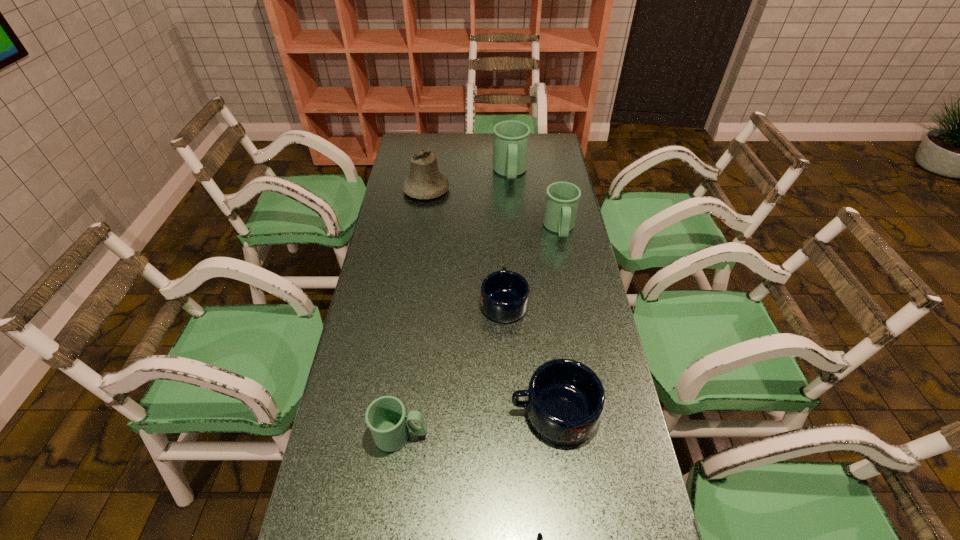
The height and width of the screenshot is (540, 960). What are the coordinates of `the farthest mug` in the screenshot? It's located at (510, 149).

Find the location of a particular element. The image size is (960, 540). the second green mug from left to right is located at coordinates (510, 149).

Where is `bell`? bell is located at coordinates (425, 181).

The width and height of the screenshot is (960, 540). Find the location of `the second biggest green mug`. the second biggest green mug is located at coordinates (562, 199).

Where is `the second farthest mug`? The height and width of the screenshot is (540, 960). the second farthest mug is located at coordinates (562, 199).

Where is `the second nearest blue mug`? The height and width of the screenshot is (540, 960). the second nearest blue mug is located at coordinates (565, 400).

Find the location of a particular element. the leftmost mug is located at coordinates pyautogui.click(x=385, y=416).

Where is `the leftmost green mug`? This screenshot has height=540, width=960. the leftmost green mug is located at coordinates (385, 416).

Where is `the farthest blue mug`? This screenshot has width=960, height=540. the farthest blue mug is located at coordinates (504, 297).

This screenshot has height=540, width=960. I want to click on the fourth nearest mug, so click(x=504, y=297).